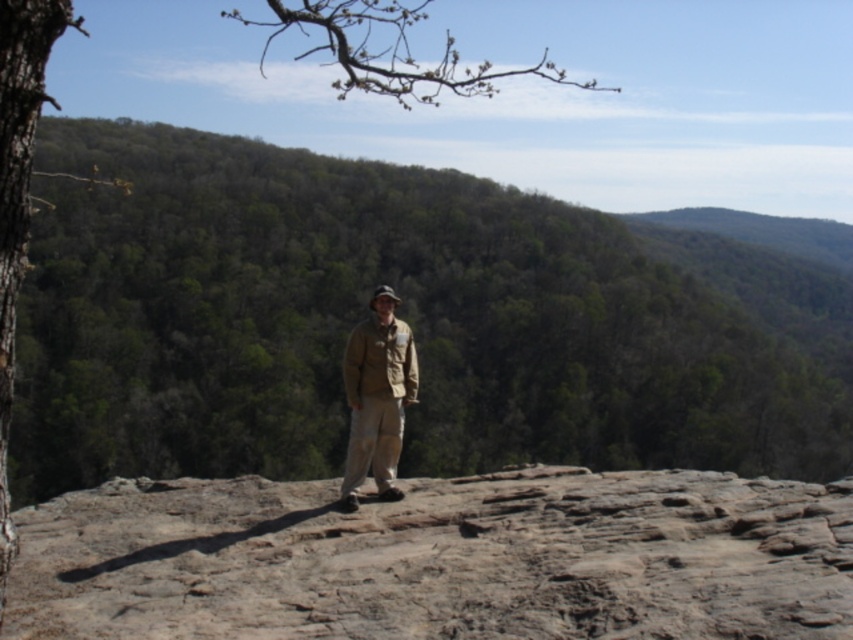
You are a hiker trying to determine which object in the scene takes up more visual space. You see the green leafy mountain at center and the smooth bark tree at upper left. Which one is larger in the image?

The smooth bark tree at upper left takes up more visual space than the green leafy mountain at center because the description states that the green leafy mountain at center occupies less space than the smooth bark tree at upper left.

You are a hiker who wants to know if you can walk directly from the brown rocky hillside at center to the smooth bark tree at upper left without any obstacles. Based on the distance provided, can you estimate whether this path is feasible?

The distance between the brown rocky hillside at center and the smooth bark tree at upper left is 578.08 feet. While the exact terrain isn

You are a drone operator and need to fly your drone from the person standing on the rocky outcrop to the green leafy mountain at center. According to the coordinates provided, where exactly should you direct the drone to land?

The green leafy mountain at center is located at coordinates point (364,316), so you should direct the drone to land there.